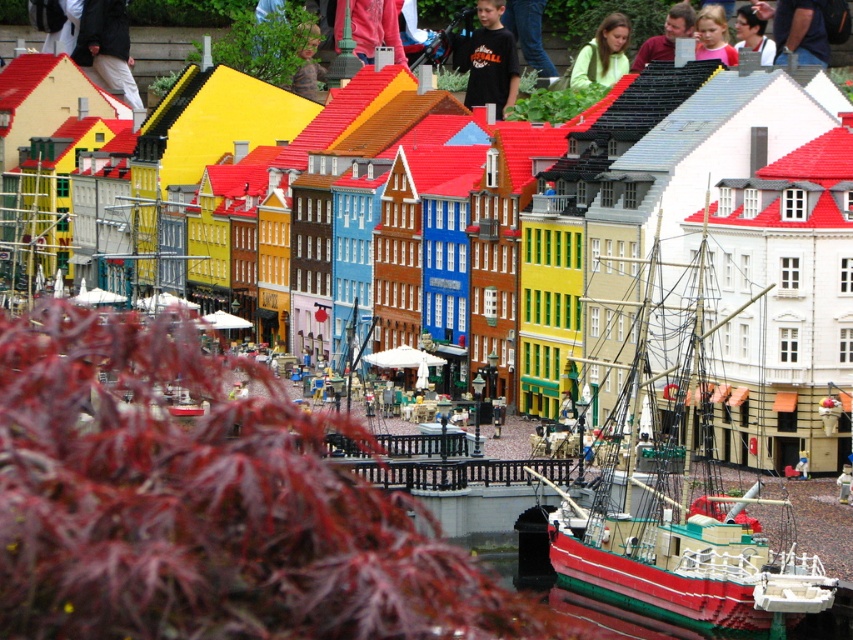
Question: Which of the following is the farthest from the observer?

Choices:
 (A) (108, 10)
 (B) (308, 42)
 (C) (755, 35)

Answer: (A)

Question: Is the position of red matte ship at center less distant than that of green matte shirt at upper center?

Choices:
 (A) yes
 (B) no

Answer: (A)

Question: Is red matte ship at center below matte black pants at upper left?

Choices:
 (A) yes
 (B) no

Answer: (A)

Question: Among these points, which one is farthest from the camera?

Choices:
 (A) (752, 44)
 (B) (500, 106)
 (C) (780, 26)

Answer: (C)

Question: Estimate the real-world distances between objects in this image. Which object is farther from the dark blue shirt at upper right?

Choices:
 (A) green matte shirt at upper center
 (B) black cotton shirt at center
 (C) matte black pants at upper left

Answer: (C)

Question: Does matte black pants at upper left have a smaller size compared to dark blue shirt at upper right?

Choices:
 (A) yes
 (B) no

Answer: (B)